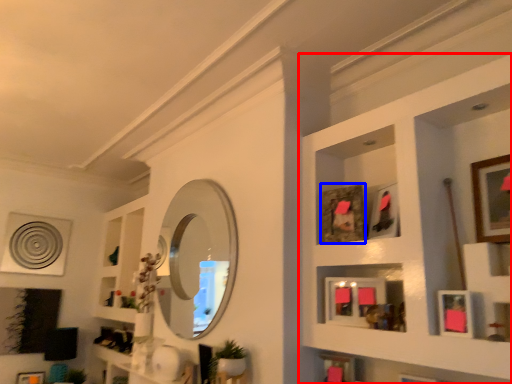
Question: Which point is closer to the camera, shelf (highlighted by a red box) or picture frame (highlighted by a blue box)?

Choices:
 (A) shelf
 (B) picture frame

Answer: (A)